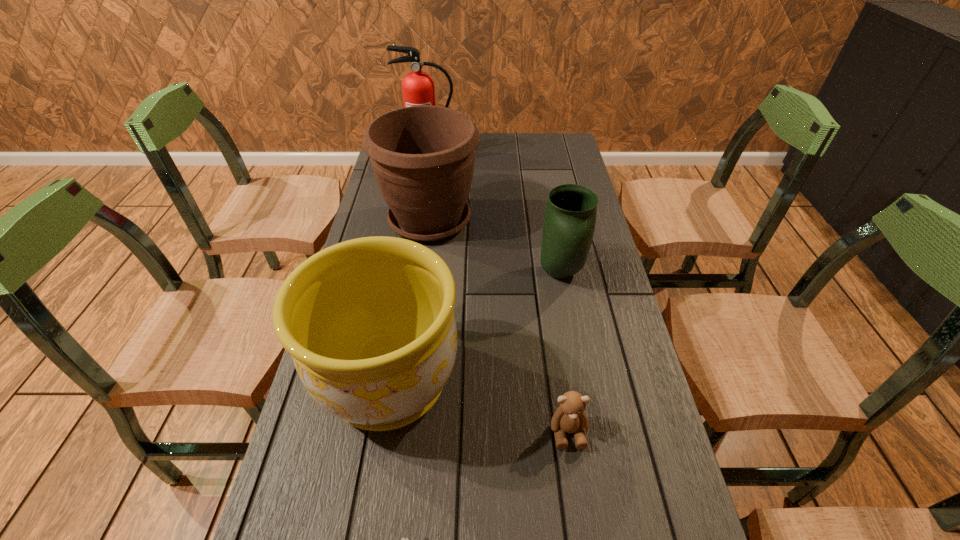
The width and height of the screenshot is (960, 540). I want to click on free location located 0.080m on the face of the teddy bear, so coord(577,492).

Image resolution: width=960 pixels, height=540 pixels. I want to click on object located in the far edge section of the desktop, so click(418, 89).

What are the coordinates of `fire extinguisher situated at the left edge` in the screenshot? It's located at (418, 89).

This screenshot has width=960, height=540. Find the location of `vase at the right edge`. vase at the right edge is located at coordinates (570, 216).

Where is `teddy bear present at the right edge`? teddy bear present at the right edge is located at coordinates (569, 417).

Identify the location of object present at the far left corner. The image size is (960, 540). (418, 89).

What are the coordinates of `free space at the far edge` in the screenshot? It's located at (x=512, y=154).

In the image, there is a desktop. Identify the location of free space at the left edge. Image resolution: width=960 pixels, height=540 pixels. coord(385,206).

In the image, there is a desktop. At what (x,y) coordinates should I click in order to perform the action: click on vacant space at the right edge. Please return your answer as a coordinate pair (x, y). The image size is (960, 540). Looking at the image, I should click on (576, 321).

Locate an element on the screen. The image size is (960, 540). free space between the vase and the farthest object is located at coordinates click(494, 216).